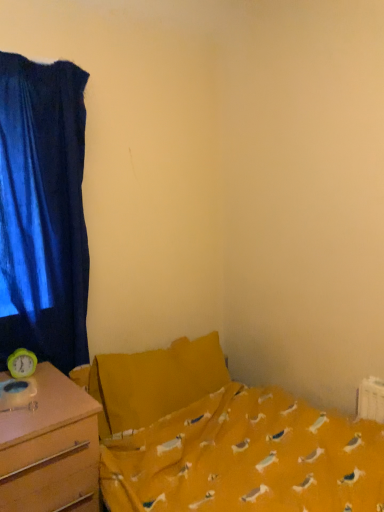
Question: From their relative heights in the image, would you say yellow fabric bed at center is taller or shorter than wooden desk at left?

Choices:
 (A) short
 (B) tall

Answer: (A)

Question: From a real-world perspective, is yellow fabric bed at center physically located above or below wooden desk at left?

Choices:
 (A) above
 (B) below

Answer: (A)

Question: Which of these objects is positioned closest to the yellow fabric bed at center?

Choices:
 (A) velvet blue curtain at left
 (B) wooden desk at left

Answer: (B)

Question: Estimate the real-world distances between objects in this image. Which object is farther from the velvet blue curtain at left?

Choices:
 (A) yellow fabric bed at center
 (B) wooden desk at left

Answer: (A)